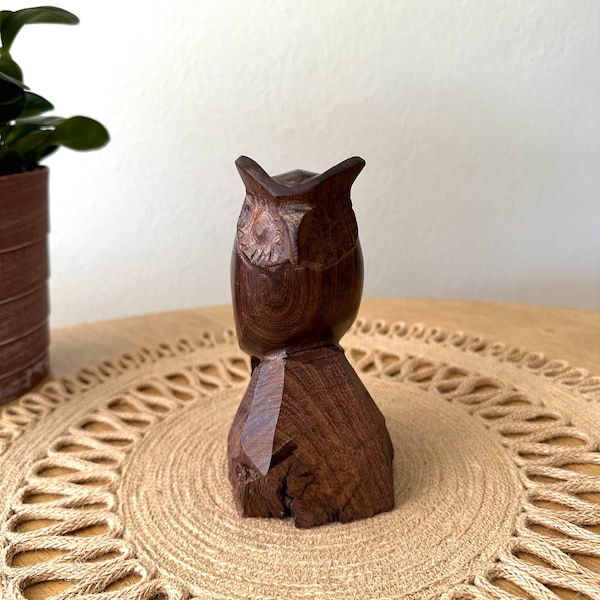
The image size is (600, 600). In order to click on wooden art in this screenshot , I will do `click(287, 457)`.